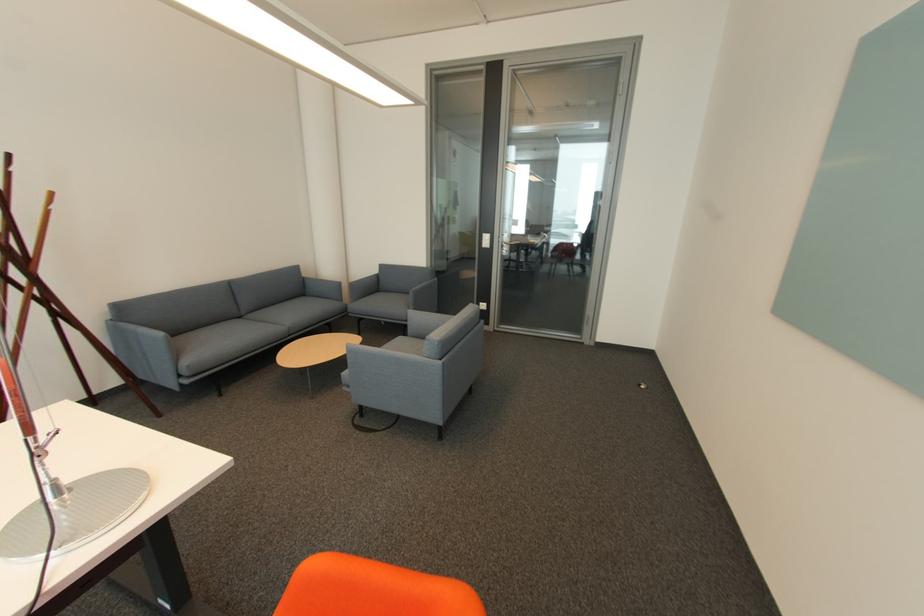
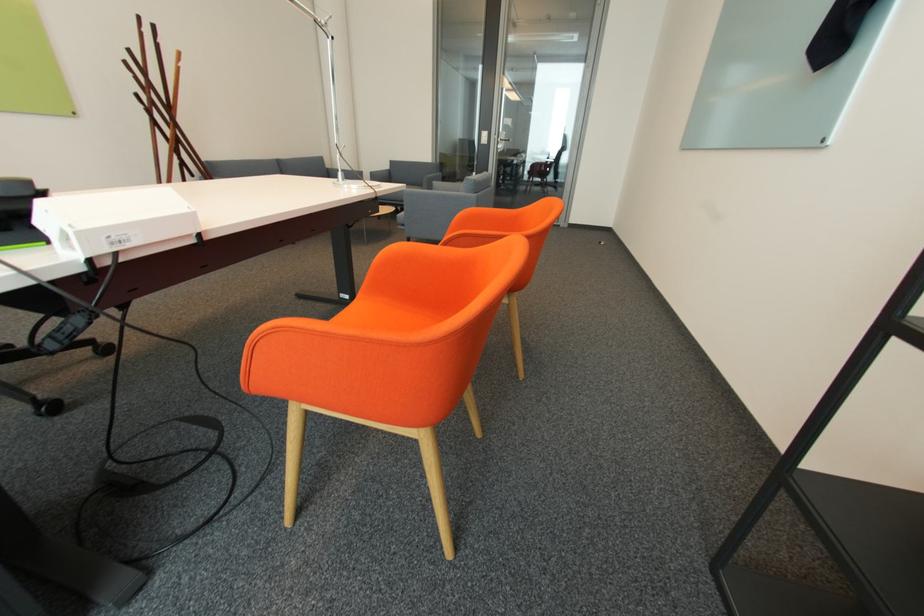
In a continuous first-person perspective shot, in which direction is the camera moving?

The cameraman walked toward left, backward.